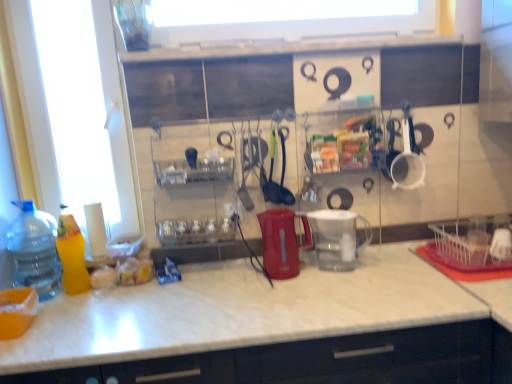
How much space does transparent plastic pitcher at center, which appears as the 2th appliance when viewed from the left, occupy vertically?

It is 9.50 inches.

How much space does green plastic ladle at center, positioned as the 3th tableware in right-to-left order, occupy horizontally?

The width of green plastic ladle at center, positioned as the 3th tableware in right-to-left order, is 5.95 inches.

Describe the element at coordinates (284, 172) in the screenshot. I see `black rubber spatula at center, marked as the 2th tableware in a left-to-right arrangement` at that location.

What is the approximate height of yellow plastic bottle at left, acting as the 1th bottle starting from the right?

yellow plastic bottle at left, acting as the 1th bottle starting from the right, is 13.97 inches tall.

What is the approximate width of transparent plastic bottle at left, marked as the second bottle in a right-to-left arrangement?

8.66 inches.

What do you see at coordinates (407, 157) in the screenshot?
I see `white plastic cup at upper right, arranged as the 3th tableware when viewed from the left` at bounding box center [407, 157].

Locate an element on the screen. matte plastic kettle at center, arranged as the second appliance when viewed from the right is located at coordinates (282, 242).

Which is farther from the camera, (x=75, y=224) or (x=272, y=269)?

The point (x=272, y=269) is farther.

Can you confirm if yellow plastic bottle at left, positioned as the 2th bottle in left-to-right order, is positioned to the left of matte plastic kettle at center, which ranks as the 1th appliance in left-to-right order?

Yes.

In the image, is yellow plastic bottle at left, acting as the 1th bottle starting from the right, positioned in front of or behind matte plastic kettle at center, which ranks as the 1th appliance in left-to-right order?

yellow plastic bottle at left, acting as the 1th bottle starting from the right, is in front of matte plastic kettle at center, which ranks as the 1th appliance in left-to-right order.

From the image's perspective, is yellow plastic bottle at left, positioned as the 2th bottle in left-to-right order, below matte plastic kettle at center, which ranks as the 1th appliance in left-to-right order?

Yes, from the image's perspective, yellow plastic bottle at left, positioned as the 2th bottle in left-to-right order, is beneath matte plastic kettle at center, which ranks as the 1th appliance in left-to-right order.

Looking at this image, based on their sizes in the image, would you say yellow plastic bottle at left, acting as the 1th bottle starting from the right, is bigger or smaller than white marble countertop at center?

In the image, yellow plastic bottle at left, acting as the 1th bottle starting from the right, appears to be smaller than white marble countertop at center.

From the image's perspective, relative to white marble countertop at center, is yellow plastic bottle at left, positioned as the 2th bottle in left-to-right order, above or below?

Based on their image positions, yellow plastic bottle at left, positioned as the 2th bottle in left-to-right order, is located above white marble countertop at center.

Consider the image. Is yellow plastic bottle at left, positioned as the 2th bottle in left-to-right order, placed right next to white marble countertop at center?

There is a gap between yellow plastic bottle at left, positioned as the 2th bottle in left-to-right order, and white marble countertop at center.

Considering the relative positions of yellow plastic bottle at left, positioned as the 2th bottle in left-to-right order, and white marble countertop at center in the image provided, is yellow plastic bottle at left, positioned as the 2th bottle in left-to-right order, to the left or to the right of white marble countertop at center?

In the image, yellow plastic bottle at left, positioned as the 2th bottle in left-to-right order, appears on the left side of white marble countertop at center.

Which is behind, transparent plastic bottle at left, marked as the second bottle in a right-to-left arrangement, or green plastic ladle at center, positioned as the 3th tableware in right-to-left order?

green plastic ladle at center, positioned as the 3th tableware in right-to-left order, is more distant.

Would you say transparent plastic bottle at left, marked as the second bottle in a right-to-left arrangement, is inside or outside green plastic ladle at center, positioned as the 3th tableware in right-to-left order?

transparent plastic bottle at left, marked as the second bottle in a right-to-left arrangement, exists outside the volume of green plastic ladle at center, positioned as the 3th tableware in right-to-left order.

Looking at this image, is transparent plastic bottle at left, marked as the second bottle in a right-to-left arrangement, at the right side of green plastic ladle at center, positioned as the 3th tableware in right-to-left order?

In fact, transparent plastic bottle at left, marked as the second bottle in a right-to-left arrangement, is to the left of green plastic ladle at center, positioned as the 3th tableware in right-to-left order.

Considering the positions of point (13, 202) and point (270, 175), is point (13, 202) closer or farther from the camera than point (270, 175)?

Clearly, point (13, 202) is closer to the camera than point (270, 175).

Is point (32, 209) closer or farther from the camera than point (341, 232)?

Clearly, point (32, 209) is more distant from the camera than point (341, 232).

Looking at this image, is transparent plastic bottle at left, marked as the second bottle in a right-to-left arrangement, shorter than transparent plastic pitcher at center, which appears as the 2th appliance when viewed from the left?

No, transparent plastic bottle at left, marked as the second bottle in a right-to-left arrangement, is not shorter than transparent plastic pitcher at center, which appears as the 2th appliance when viewed from the left.

Is the surface of transparent plastic bottle at left, marked as the second bottle in a right-to-left arrangement, in direct contact with transparent plastic pitcher at center, acting as the 1th appliance starting from the right?

There is a gap between transparent plastic bottle at left, marked as the second bottle in a right-to-left arrangement, and transparent plastic pitcher at center, acting as the 1th appliance starting from the right.

Which appliance is the 2nd one when counting from the right side of the transparent plastic bottle at left, marked as the second bottle in a right-to-left arrangement? Please provide its 2D coordinates.

[(337, 238)]

At what (x,y) coordinates should I click in order to perform the action: click on bottle that is the 1st one when counting downward from the white plastic cup at upper right, the first tableware in the right-to-left sequence (from the image's perspective). Please return your answer as a coordinate pair (x, y). The height and width of the screenshot is (384, 512). Looking at the image, I should click on (71, 254).

Between white plastic cup at upper right, the first tableware in the right-to-left sequence, and yellow plastic bottle at left, acting as the 1th bottle starting from the right, which one has smaller width?

Thinner between the two is yellow plastic bottle at left, acting as the 1th bottle starting from the right.

Is point (421, 176) closer to viewer compared to point (77, 247)?

No, it is not.

Which object is positioned more to the right, white plastic cup at upper right, arranged as the 3th tableware when viewed from the left, or yellow plastic bottle at left, positioned as the 2th bottle in left-to-right order?

Positioned to the right is white plastic cup at upper right, arranged as the 3th tableware when viewed from the left.

Could transparent plastic bottle at left, marked as the second bottle in a right-to-left arrangement, be considered to be inside black rubber spatula at center, the second tableware positioned from the right?

No, transparent plastic bottle at left, marked as the second bottle in a right-to-left arrangement, is not inside black rubber spatula at center, the second tableware positioned from the right.

From the image's perspective, count 1st tablewares upward from the transparent plastic bottle at left, marked as the second bottle in a right-to-left arrangement, and point to it. Please provide its 2D coordinates.

[(284, 172)]

Looking at this image, which object is further away from the camera, black rubber spatula at center, the second tableware positioned from the right, or transparent plastic bottle at left, which appears as the 1th bottle when viewed from the left?

Positioned behind is black rubber spatula at center, the second tableware positioned from the right.

Is matte plastic kettle at center, which ranks as the 1th appliance in left-to-right order, at the left side of green plastic ladle at center, which is the first tableware in left-to-right order?

Incorrect, matte plastic kettle at center, which ranks as the 1th appliance in left-to-right order, is not on the left side of green plastic ladle at center, which is the first tableware in left-to-right order.

Is matte plastic kettle at center, arranged as the second appliance when viewed from the right, behind green plastic ladle at center, positioned as the 3th tableware in right-to-left order?

No, matte plastic kettle at center, arranged as the second appliance when viewed from the right, is in front of green plastic ladle at center, positioned as the 3th tableware in right-to-left order.

What are the coordinates of `the 1st appliance in front when counting from the green plastic ladle at center, which is the first tableware in left-to-right order` in the screenshot? It's located at (282, 242).

From a real-world perspective, does matte plastic kettle at center, arranged as the second appliance when viewed from the right, sit lower than green plastic ladle at center, which is the first tableware in left-to-right order?

Correct, in the physical world, matte plastic kettle at center, arranged as the second appliance when viewed from the right, is lower than green plastic ladle at center, which is the first tableware in left-to-right order.

Locate an element on the screen. the 1st appliance below the yellow plastic bottle at left, positioned as the 2th bottle in left-to-right order (from a real-world perspective) is located at coordinates (282, 242).

This screenshot has height=384, width=512. Identify the location of the 2nd bottle above the white marble countertop at center (from the image's perspective). (71, 254).

Looking at the image, which one is located closer to green plastic ladle at center, which is the first tableware in left-to-right order, black rubber spatula at center, marked as the 2th tableware in a left-to-right arrangement, or white marble countertop at center?

black rubber spatula at center, marked as the 2th tableware in a left-to-right arrangement, is closer to green plastic ladle at center, which is the first tableware in left-to-right order.

When comparing their distances from black rubber spatula at center, marked as the 2th tableware in a left-to-right arrangement, does transparent plastic pitcher at center, acting as the 1th appliance starting from the right, or white plastic cup at upper right, arranged as the 3th tableware when viewed from the left, seem further?

white plastic cup at upper right, arranged as the 3th tableware when viewed from the left.

Based on their spatial positions, is yellow plastic bottle at left, acting as the 1th bottle starting from the right, or black rubber spatula at center, the second tableware positioned from the right, further from matte plastic kettle at center, arranged as the second appliance when viewed from the right?

Based on the image, yellow plastic bottle at left, acting as the 1th bottle starting from the right, appears to be further to matte plastic kettle at center, arranged as the second appliance when viewed from the right.

Estimate the real-world distances between objects in this image. Which object is further from transparent plastic bottle at left, which appears as the 1th bottle when viewed from the left, white plastic cup at upper right, arranged as the 3th tableware when viewed from the left, or white marble countertop at center?

white plastic cup at upper right, arranged as the 3th tableware when viewed from the left, is further to transparent plastic bottle at left, which appears as the 1th bottle when viewed from the left.

Looking at the image, which one is located further to white marble countertop at center, white plastic cup at upper right, the first tableware in the right-to-left sequence, or yellow plastic bottle at left, acting as the 1th bottle starting from the right?

white plastic cup at upper right, the first tableware in the right-to-left sequence.

Consider the image. When comparing their distances from white marble countertop at center, does white plastic cup at upper right, the first tableware in the right-to-left sequence, or black rubber spatula at center, marked as the 2th tableware in a left-to-right arrangement, seem further?

white plastic cup at upper right, the first tableware in the right-to-left sequence.

Considering their positions, is transparent plastic bottle at left, which appears as the 1th bottle when viewed from the left, positioned closer to green plastic ladle at center, which is the first tableware in left-to-right order, than black rubber spatula at center, the second tableware positioned from the right?

black rubber spatula at center, the second tableware positioned from the right, lies closer to green plastic ladle at center, which is the first tableware in left-to-right order, than the other object.

Looking at the image, which one is located further to black rubber spatula at center, marked as the 2th tableware in a left-to-right arrangement, white plastic cup at upper right, arranged as the 3th tableware when viewed from the left, or transparent plastic bottle at left, which appears as the 1th bottle when viewed from the left?

The object further to black rubber spatula at center, marked as the 2th tableware in a left-to-right arrangement, is transparent plastic bottle at left, which appears as the 1th bottle when viewed from the left.

At what (x,y) coordinates should I click in order to perform the action: click on appliance between transparent plastic bottle at left, which appears as the 1th bottle when viewed from the left, and white marble countertop at center, in the horizontal direction. Please return your answer as a coordinate pair (x, y). This screenshot has width=512, height=384. Looking at the image, I should click on (282, 242).

Locate an element on the screen. bottle between transparent plastic bottle at left, which appears as the 1th bottle when viewed from the left, and green plastic ladle at center, positioned as the 3th tableware in right-to-left order, in the horizontal direction is located at coordinates (71, 254).

Image resolution: width=512 pixels, height=384 pixels. I want to click on tableware between transparent plastic bottle at left, which appears as the 1th bottle when viewed from the left, and black rubber spatula at center, the second tableware positioned from the right, so click(271, 177).

Find the location of a particular element. Image resolution: width=512 pixels, height=384 pixels. appliance between yellow plastic bottle at left, acting as the 1th bottle starting from the right, and white marble countertop at center is located at coordinates (282, 242).